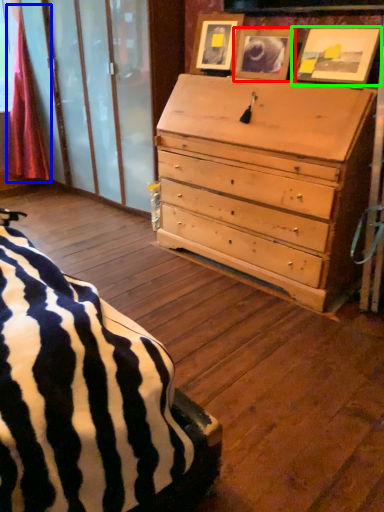
Question: Considering the real-world distances, which object is farthest from picture frame (highlighted by a red box)? curtain (highlighted by a blue box) or picture frame (highlighted by a green box)?

Choices:
 (A) curtain
 (B) picture frame

Answer: (A)